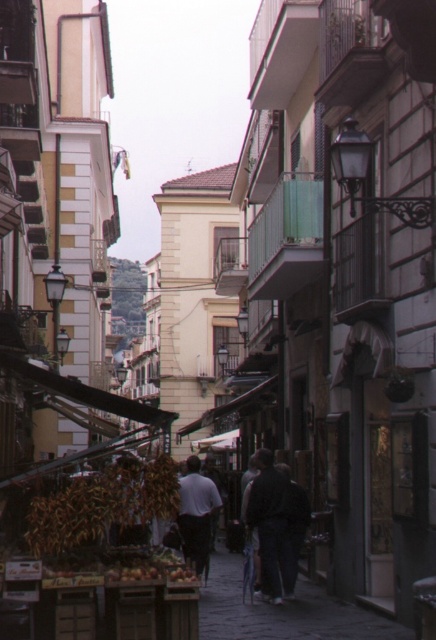
Does brown matte dried corn at center have a greater height compared to dark gray jacket at center?

No.

Does point (64, 493) lie behind point (258, 492)?

No, it is in front of (258, 492).

What are the coordinates of `brown matte dried corn at center` in the screenshot? It's located at (102, 506).

Which is above, brown matte dried corn at center or light gray fabric shirt at center?

Positioned higher is brown matte dried corn at center.

Is brown matte dried corn at center further to camera compared to light gray fabric shirt at center?

That is False.

The height and width of the screenshot is (640, 436). Describe the element at coordinates (102, 506) in the screenshot. I see `brown matte dried corn at center` at that location.

You are a GUI agent. You are given a task and a screenshot of the screen. Output one action in this format:
    pyautogui.click(x=<x>, y=<y>)
    Task: Click on the brown matte dried corn at center
    
    Given the screenshot: What is the action you would take?
    pyautogui.click(x=102, y=506)

Is point (157, 458) closer to viewer compared to point (292, 564)?

Yes, point (157, 458) is in front of point (292, 564).

This screenshot has height=640, width=436. What do you see at coordinates (102, 506) in the screenshot?
I see `brown matte dried corn at center` at bounding box center [102, 506].

Locate an element on the screen. The height and width of the screenshot is (640, 436). brown matte dried corn at center is located at coordinates (102, 506).